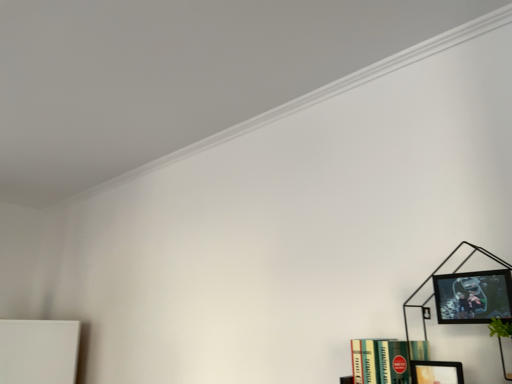
Image resolution: width=512 pixels, height=384 pixels. In order to click on black matte bookcase at right in this screenshot , I will do `click(448, 275)`.

What is the approximate width of matte black picture frame at upper right, which is the 2th picture frame from bottom to top?

matte black picture frame at upper right, which is the 2th picture frame from bottom to top, is 3.70 centimeters wide.

Describe the element at coordinates (473, 297) in the screenshot. This screenshot has width=512, height=384. I see `matte black picture frame at upper right, the 1th picture frame in the top-to-bottom sequence` at that location.

This screenshot has width=512, height=384. Describe the element at coordinates (384, 360) in the screenshot. I see `green matte book at lower right` at that location.

At what (x,y) coordinates should I click in order to perform the action: click on black matte bookcase at right. Please return your answer as a coordinate pair (x, y). Looking at the image, I should click on (448, 275).

Could green matte book at lower right be considered to be inside black matte bookcase at right?

No, green matte book at lower right is not inside black matte bookcase at right.

Is the depth of black matte bookcase at right less than that of green matte book at lower right?

Yes, it is.

Visually, is black matte bookcase at right positioned to the left or to the right of green matte book at lower right?

black matte bookcase at right is positioned on green matte book at lower right's right side.

How many degrees apart are the facing directions of black matte bookcase at right and green matte book at lower right?

The facing directions of black matte bookcase at right and green matte book at lower right are 3.37e-05 degrees apart.

Is matte black picture frame at upper right, which is the 2th picture frame from bottom to top, not close to black matte bookcase at right?

No, matte black picture frame at upper right, which is the 2th picture frame from bottom to top, is in close proximity to black matte bookcase at right.

Consider the image. From the image's perspective, is matte black picture frame at upper right, which is the 2th picture frame from bottom to top, located above or below black matte bookcase at right?

matte black picture frame at upper right, which is the 2th picture frame from bottom to top, is situated higher than black matte bookcase at right in the image.

Which is closer to the camera, (x=477, y=292) or (x=490, y=256)?

Point (x=477, y=292) is positioned closer to the camera compared to point (x=490, y=256).

How much distance is there between matte black picture frame at upper right, the 1th picture frame in the top-to-bottom sequence, and black matte bookcase at right?

7.04 inches.

Is green matte book at lower right positioned far away from matte black picture frame at lower right, which is the first picture frame from bottom to top?

green matte book at lower right is actually quite close to matte black picture frame at lower right, which is the first picture frame from bottom to top.

Is green matte book at lower right in front of or behind matte black picture frame at lower right, which is the first picture frame from bottom to top, in the image?

green matte book at lower right is positioned farther from the viewer than matte black picture frame at lower right, which is the first picture frame from bottom to top.

Is green matte book at lower right inside or outside of matte black picture frame at lower right, which is the first picture frame from bottom to top?

green matte book at lower right is not inside matte black picture frame at lower right, which is the first picture frame from bottom to top, it's outside.

Is point (484, 281) more distant than point (397, 346)?

No, (484, 281) is in front of (397, 346).

Is matte black picture frame at upper right, the 1th picture frame in the top-to-bottom sequence, at the left side of green matte book at lower right?

Incorrect, matte black picture frame at upper right, the 1th picture frame in the top-to-bottom sequence, is not on the left side of green matte book at lower right.

Which of these two, matte black picture frame at upper right, the 1th picture frame in the top-to-bottom sequence, or green matte book at lower right, is smaller?

matte black picture frame at upper right, the 1th picture frame in the top-to-bottom sequence, is smaller.

Which of these two, matte black picture frame at upper right, the 1th picture frame in the top-to-bottom sequence, or green matte book at lower right, stands taller?

Standing taller between the two is green matte book at lower right.

Is matte black picture frame at lower right, which is the first picture frame from bottom to top, situated inside green matte book at lower right or outside?

matte black picture frame at lower right, which is the first picture frame from bottom to top, cannot be found inside green matte book at lower right.

From a real-world perspective, is matte black picture frame at lower right, which is the second picture frame from top to bottom, under green matte book at lower right?

Yes, from a real-world perspective, matte black picture frame at lower right, which is the second picture frame from top to bottom, is under green matte book at lower right.

Considering the relative sizes of matte black picture frame at lower right, which is the first picture frame from bottom to top, and green matte book at lower right in the image provided, is matte black picture frame at lower right, which is the first picture frame from bottom to top, smaller than green matte book at lower right?

Correct, matte black picture frame at lower right, which is the first picture frame from bottom to top, occupies less space than green matte book at lower right.

Does matte black picture frame at lower right, which is the second picture frame from top to bottom, have a lesser height compared to green matte book at lower right?

Indeed, matte black picture frame at lower right, which is the second picture frame from top to bottom, has a lesser height compared to green matte book at lower right.

Is matte black picture frame at lower right, which is the first picture frame from bottom to top, positioned beyond the bounds of black matte bookcase at right?

No, matte black picture frame at lower right, which is the first picture frame from bottom to top, is inside or overlapping with black matte bookcase at right.

From the image's perspective, is matte black picture frame at lower right, which is the first picture frame from bottom to top, above or below black matte bookcase at right?

matte black picture frame at lower right, which is the first picture frame from bottom to top, is situated lower than black matte bookcase at right in the image.

In the image, is matte black picture frame at lower right, which is the first picture frame from bottom to top, positioned in front of or behind black matte bookcase at right?

Visually, matte black picture frame at lower right, which is the first picture frame from bottom to top, is located behind black matte bookcase at right.

In terms of size, does matte black picture frame at lower right, which is the second picture frame from top to bottom, appear bigger or smaller than black matte bookcase at right?

Considering their sizes, matte black picture frame at lower right, which is the second picture frame from top to bottom, takes up less space than black matte bookcase at right.

From the image's perspective, between green matte book at lower right and black matte bookcase at right, which one is located above?

black matte bookcase at right is shown above in the image.

Is green matte book at lower right oriented towards black matte bookcase at right?

No, green matte book at lower right does not turn towards black matte bookcase at right.

Is green matte book at lower right outside of black matte bookcase at right?

That's correct, green matte book at lower right is outside of black matte bookcase at right.

Image resolution: width=512 pixels, height=384 pixels. What are the coordinates of `bookcase located in front of the green matte book at lower right` in the screenshot? It's located at (448, 275).

This screenshot has height=384, width=512. Identify the location of picture frame located above the black matte bookcase at right (from the image's perspective). (473, 297).

Looking at the image, which one is located closer to green matte book at lower right, black matte bookcase at right or matte black picture frame at lower right, which is the second picture frame from top to bottom?

Based on the image, black matte bookcase at right appears to be nearer to green matte book at lower right.

Considering their positions, is green matte book at lower right positioned further to matte black picture frame at lower right, which is the first picture frame from bottom to top, than matte black picture frame at upper right, which is the 2th picture frame from bottom to top?

The object further to matte black picture frame at lower right, which is the first picture frame from bottom to top, is matte black picture frame at upper right, which is the 2th picture frame from bottom to top.

Estimate the real-world distances between objects in this image. Which object is closer to matte black picture frame at upper right, the 1th picture frame in the top-to-bottom sequence, green matte book at lower right or matte black picture frame at lower right, which is the second picture frame from top to bottom?

The object closer to matte black picture frame at upper right, the 1th picture frame in the top-to-bottom sequence, is matte black picture frame at lower right, which is the second picture frame from top to bottom.

Considering their positions, is matte black picture frame at upper right, which is the 2th picture frame from bottom to top, positioned further to black matte bookcase at right than matte black picture frame at lower right, which is the second picture frame from top to bottom?

matte black picture frame at upper right, which is the 2th picture frame from bottom to top.

Which object lies nearer to the anchor point matte black picture frame at lower right, which is the first picture frame from bottom to top, green matte book at lower right or black matte bookcase at right?

green matte book at lower right is closer to matte black picture frame at lower right, which is the first picture frame from bottom to top.

Estimate the real-world distances between objects in this image. Which object is closer to green matte book at lower right, black matte bookcase at right or matte black picture frame at upper right, the 1th picture frame in the top-to-bottom sequence?

black matte bookcase at right.

Considering their positions, is matte black picture frame at lower right, which is the second picture frame from top to bottom, positioned closer to black matte bookcase at right than green matte book at lower right?

Among the two, green matte book at lower right is located nearer to black matte bookcase at right.

Estimate the real-world distances between objects in this image. Which object is closer to green matte book at lower right, matte black picture frame at lower right, which is the second picture frame from top to bottom, or black matte bookcase at right?

black matte bookcase at right is positioned closer to the anchor green matte book at lower right.

What are the coordinates of `bookcase between matte black picture frame at upper right, the 1th picture frame in the top-to-bottom sequence, and matte black picture frame at lower right, which is the first picture frame from bottom to top, in the vertical direction` in the screenshot? It's located at (448, 275).

This screenshot has width=512, height=384. I want to click on picture frame that lies between matte black picture frame at upper right, the 1th picture frame in the top-to-bottom sequence, and green matte book at lower right from top to bottom, so click(x=436, y=372).

This screenshot has height=384, width=512. What are the coordinates of `bookcase between matte black picture frame at upper right, the 1th picture frame in the top-to-bottom sequence, and green matte book at lower right from top to bottom` in the screenshot? It's located at (448, 275).

Image resolution: width=512 pixels, height=384 pixels. I want to click on picture frame between black matte bookcase at right and green matte book at lower right from top to bottom, so click(436, 372).